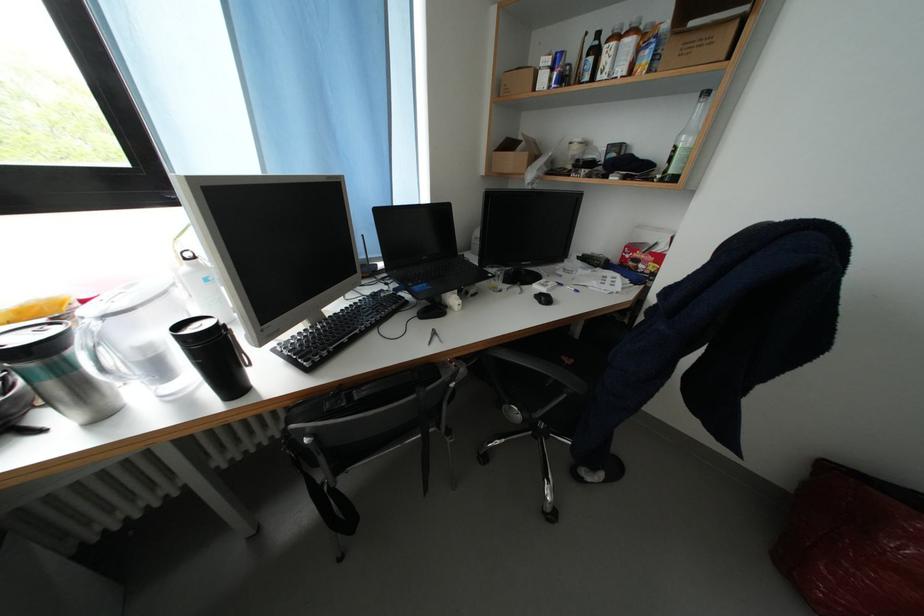
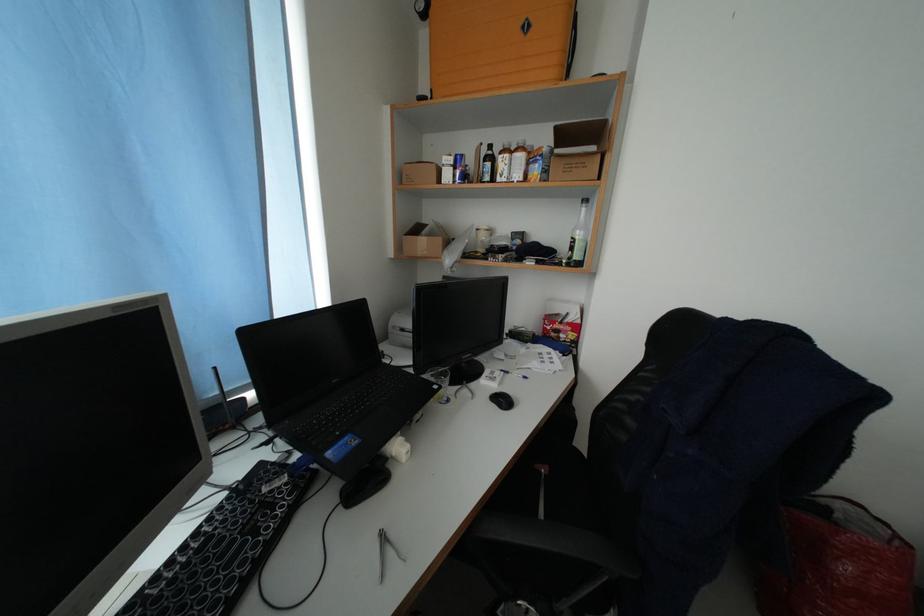
Where in the second image is the point corresponding to point (580, 365) from the first image?

(555, 472)